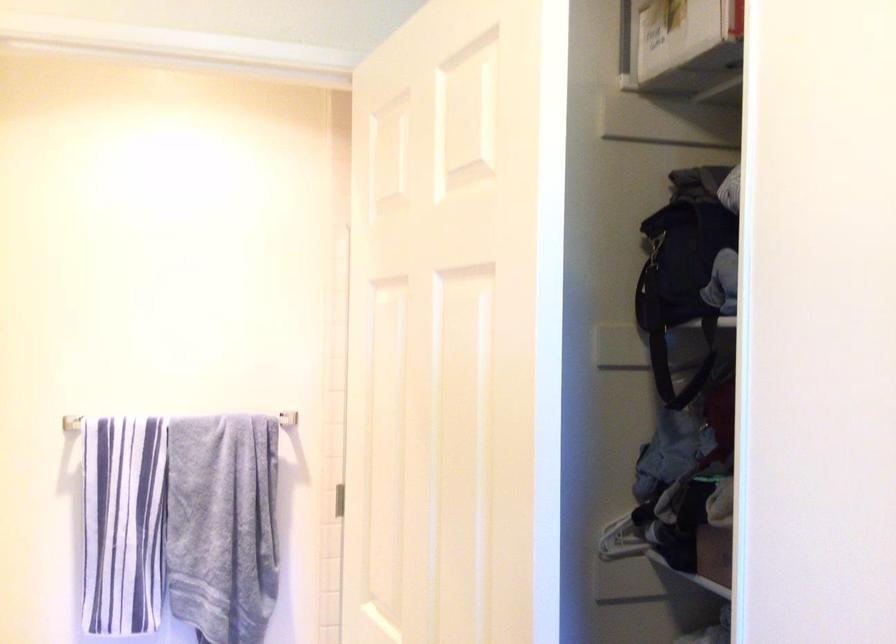
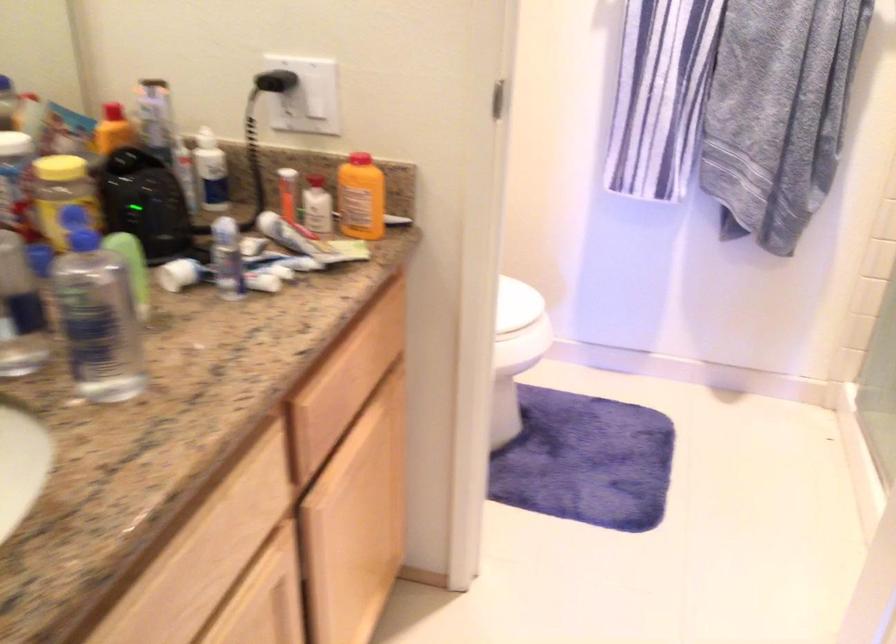
The images are taken continuously from a first-person perspective. In which direction is your viewpoint rotating?

The camera rotated toward left-down.